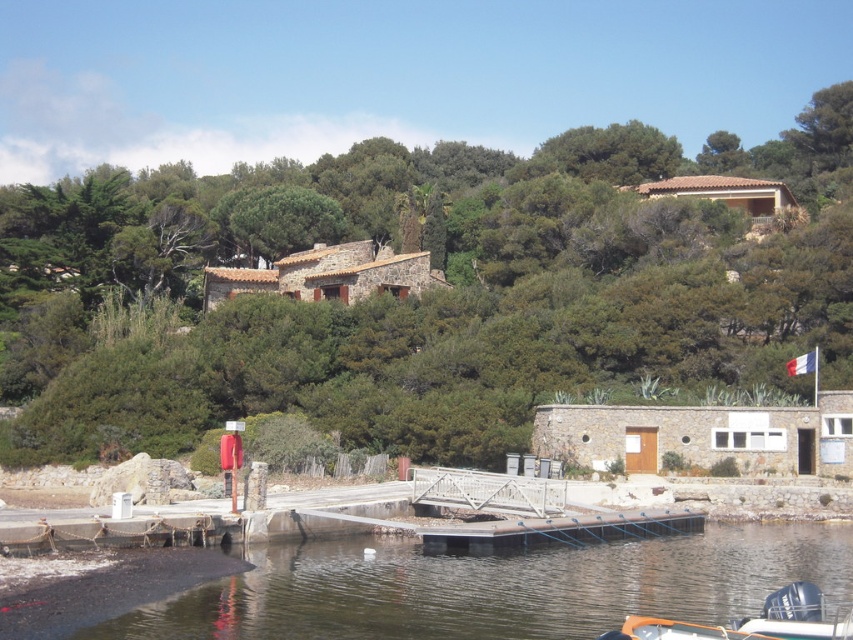
You are standing on the dock and see the clear water at lower center and the orange plastic boat at lower right. Which object is closer to the left side of the dock?

The clear water at lower center is positioned on the left side of orange plastic boat at lower right, so it is closer to the left side of the dock.

You are a boat operator who needs to launch the orange plastic boat at lower right into the clear water at lower center. Based on their sizes, will the boat fit into the water without any issues?

The clear water at lower center has a larger size compared to the orange plastic boat at lower right, so the boat should fit into the water without any issues.